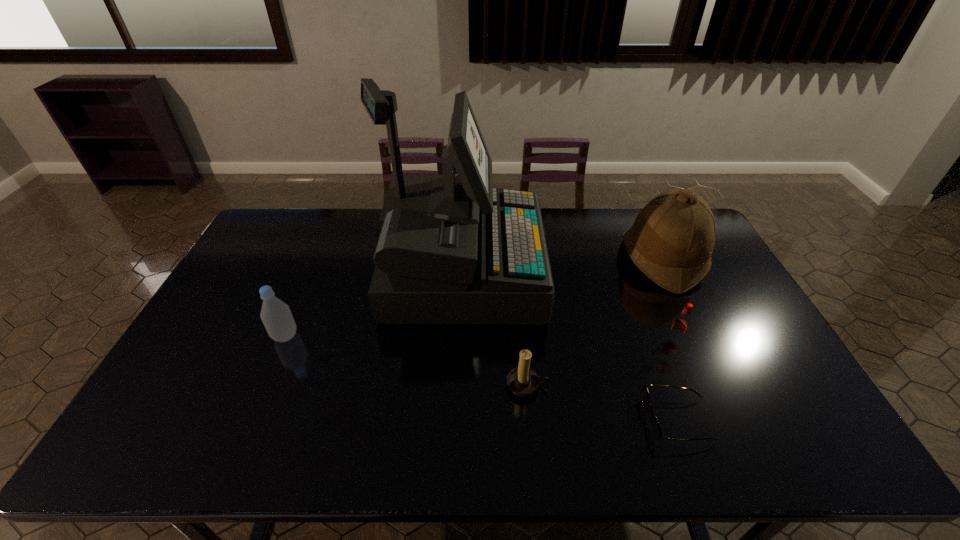
Find the location of `object located at the right edge`. object located at the right edge is located at coordinates 671,241.

At what (x,y) coordinates should I click in order to perform the action: click on object that is positioned at the far right corner. Please return your answer as a coordinate pair (x, y). Image resolution: width=960 pixels, height=540 pixels. Looking at the image, I should click on (671, 241).

Locate an element on the screen. This screenshot has width=960, height=540. vacant space at the far edge is located at coordinates (376, 245).

Where is `vacant space at the near edge of the desktop`? The height and width of the screenshot is (540, 960). vacant space at the near edge of the desktop is located at coordinates (223, 434).

The width and height of the screenshot is (960, 540). Identify the location of vacant space at the left edge of the desktop. (240, 330).

Identify the location of free space at the right edge of the desktop. Image resolution: width=960 pixels, height=540 pixels. (730, 315).

Where is `free region at the near left corner of the desktop`? Image resolution: width=960 pixels, height=540 pixels. free region at the near left corner of the desktop is located at coordinates (177, 443).

The width and height of the screenshot is (960, 540). Identify the location of free space between the candle holder and the shortest object. (603, 403).

I want to click on unoccupied position between the bottle and the candle holder, so click(406, 361).

Locate an element on the screen. This screenshot has height=540, width=960. free space between the hat and the root beer is located at coordinates (668, 300).